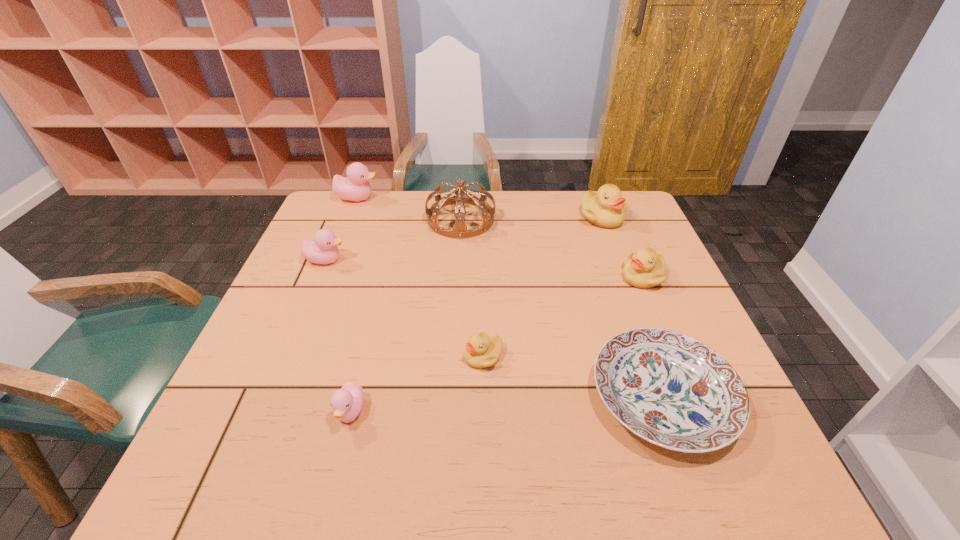
Where is `free point located on the front-facing side of the fourth duckling from left to right`? free point located on the front-facing side of the fourth duckling from left to right is located at coordinates (432, 356).

Where is `blank space located on the back of the plate`? The height and width of the screenshot is (540, 960). blank space located on the back of the plate is located at coordinates (634, 317).

Locate an element on the screen. The image size is (960, 540). tiara at the far edge is located at coordinates (459, 231).

The width and height of the screenshot is (960, 540). What are the coordinates of `object that is at the near edge` in the screenshot? It's located at (670, 389).

Identify the location of plate positioned at the right edge. This screenshot has width=960, height=540. (670, 389).

Find the location of a particular element. object situated at the far left corner is located at coordinates (355, 187).

Identify the location of object at the far right corner. Image resolution: width=960 pixels, height=540 pixels. (606, 208).

The width and height of the screenshot is (960, 540). Find the location of `object that is at the near right corner`. object that is at the near right corner is located at coordinates (670, 389).

In the image, there is a desktop. Identify the location of vacant space at the far edge. (381, 227).

Find the location of `vacant point at the left edge`. vacant point at the left edge is located at coordinates (324, 271).